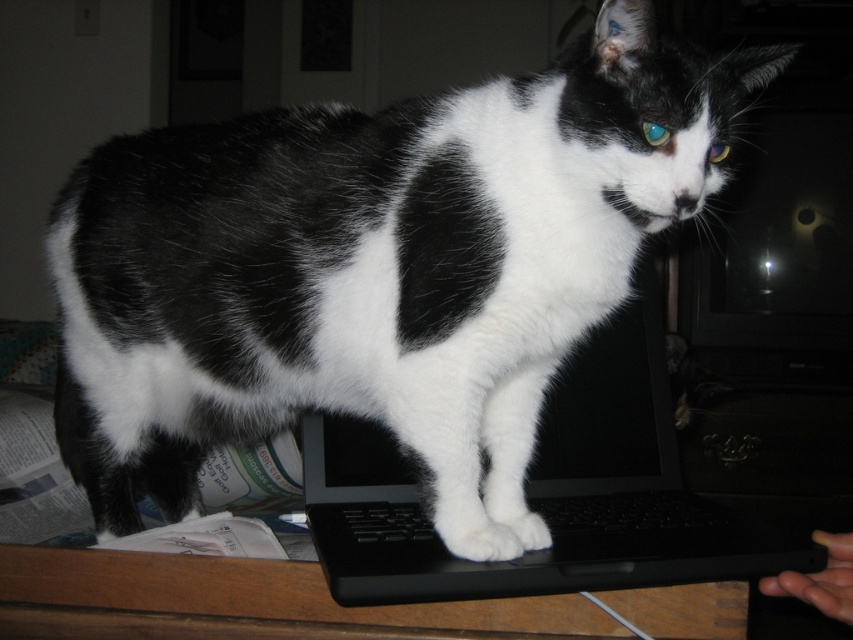
You need to place a new mouse on the right side of the black matte keyboard at center. Where should you place it relative to the black plastic laptop at center?

The black plastic laptop at center is on the left side of the black matte keyboard at center, so you should place the new mouse to the right of the black matte keyboard at center, which would be the opposite side of the black plastic laptop at center.

You are trying to type a document on your computer but notice the black plastic laptop at center and the black matte keyboard at center. Which one is physically covering the other?

The black plastic laptop at center is positioned over the black matte keyboard at center, meaning the laptop is covering the keyboard.